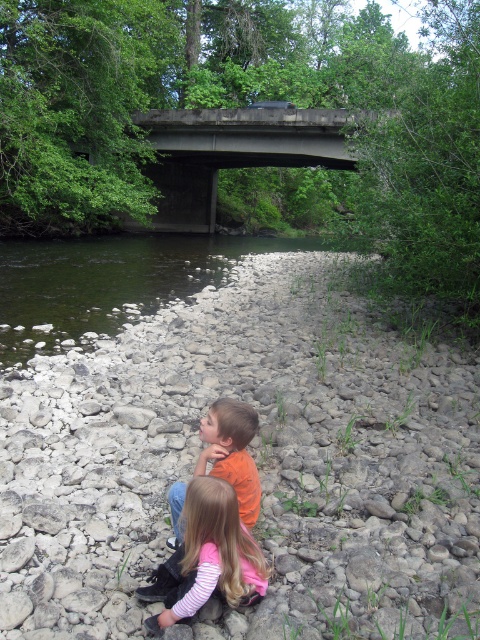
You are a photographer trying to capture a photo of the two children sitting on the riverbank. You want to ensure both the light pink striped shirt at lower center and the orange matte shirt at center are clearly visible in the frame. Based on their positions, which child should you focus on first to ensure both are in focus?

The light pink striped shirt at lower center is positioned on the left side of orange matte shirt at center. To ensure both are in focus, you should focus on the orange matte shirt at center first since it is closer to the center of the scene and the light pink striped shirt at lower center is adjacent to it on the left.

You are a hiker who wants to cross the river. You see the gray rocky river bank at lower center and the green smooth water at center. Which one is shorter and therefore safer to step on?

The gray rocky river bank at lower center is shorter than the green smooth water at center, so it is safer to step on the gray rocky river bank at lower center.